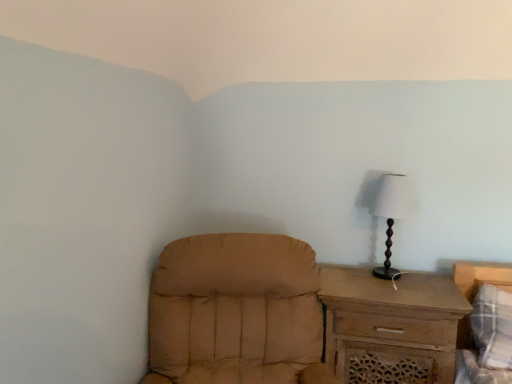
Locate an element on the screen. This screenshot has width=512, height=384. vacant area on top of white fabric lampshade at right (from a real-world perspective) is located at coordinates (391, 179).